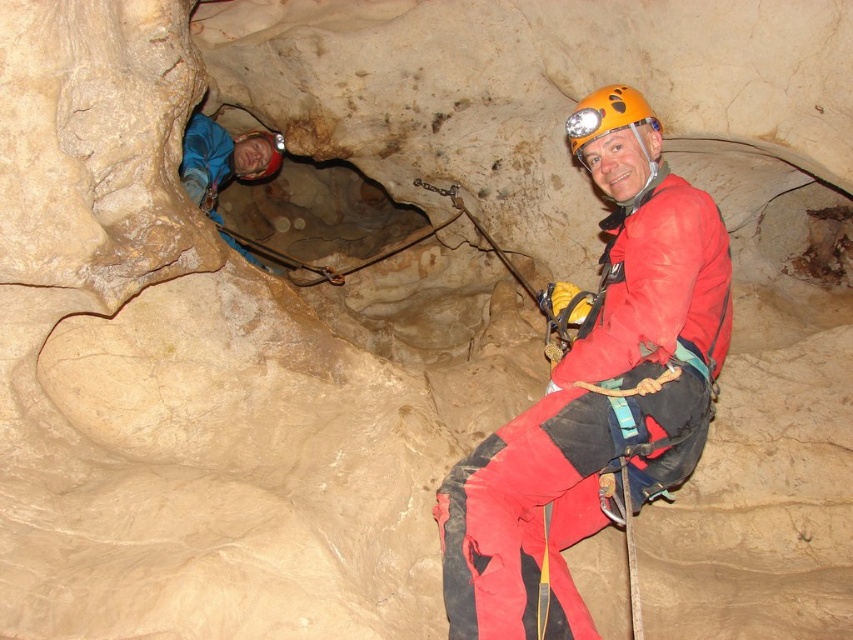
Question: Can you confirm if matte red jumpsuit at center is wider than brushed metal helmet at upper center?

Choices:
 (A) yes
 (B) no

Answer: (A)

Question: In this image, where is orange matte helmet at upper center located relative to brushed metal helmet at upper center?

Choices:
 (A) right
 (B) left

Answer: (A)

Question: Is the position of matte red jumpsuit at center more distant than that of orange matte helmet at upper center?

Choices:
 (A) no
 (B) yes

Answer: (A)

Question: Which point appears closest to the camera in this image?

Choices:
 (A) (556, 600)
 (B) (263, 134)
 (C) (569, 140)
 (D) (194, 161)

Answer: (A)

Question: Which of these objects is positioned closest to the blue fabric helmet at upper left?

Choices:
 (A) matte red jumpsuit at center
 (B) orange matte helmet at upper center

Answer: (B)

Question: Estimate the real-world distances between objects in this image. Which object is farther from the orange matte helmet at upper center?

Choices:
 (A) blue fabric helmet at upper left
 (B) brushed metal helmet at upper center

Answer: (B)